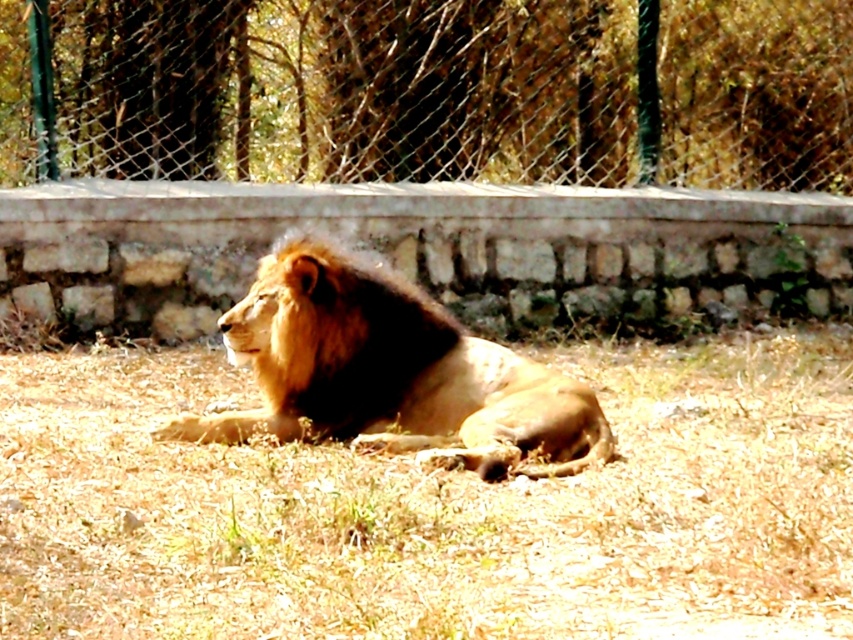
Is point (486, 632) behind point (427, 10)?

No, it is not.

Based on the photo, between brown dry grass at center and wire mesh fence at center, which one is positioned lower?

brown dry grass at center

You are a GUI agent. You are given a task and a screenshot of the screen. Output one action in this format:
    pyautogui.click(x=<x>, y=<y>)
    Task: Click on the brown dry grass at center
    The height and width of the screenshot is (640, 853).
    Given the screenshot: What is the action you would take?
    pyautogui.click(x=433, y=508)

Where is `brown dry grass at center`? The width and height of the screenshot is (853, 640). brown dry grass at center is located at coordinates (433, 508).

Which is above, brown dry grass at center or brown fuzzy mane at center?

brown fuzzy mane at center is higher up.

Is brown dry grass at center below brown fuzzy mane at center?

Indeed, brown dry grass at center is positioned under brown fuzzy mane at center.

Where is `brown dry grass at center`? brown dry grass at center is located at coordinates [x=433, y=508].

Between point (479, 1) and point (370, 280), which one is positioned behind?

The point (479, 1) is behind.

Is point (701, 4) positioned after point (392, 301)?

Yes, point (701, 4) is farther from viewer.

This screenshot has width=853, height=640. Describe the element at coordinates (430, 90) in the screenshot. I see `wire mesh fence at center` at that location.

What are the coordinates of `wire mesh fence at center` in the screenshot? It's located at tap(430, 90).